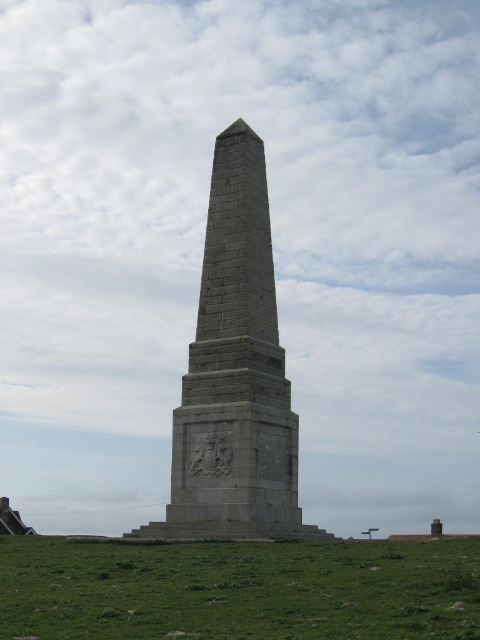
Measure the distance between green grassy field at lower center and gray stone obelisk at center.

50.68 feet

Does point (335, 560) come behind point (252, 497)?

No.

The height and width of the screenshot is (640, 480). What do you see at coordinates (239, 589) in the screenshot?
I see `green grassy field at lower center` at bounding box center [239, 589].

Identify the location of green grassy field at lower center. [x=239, y=589].